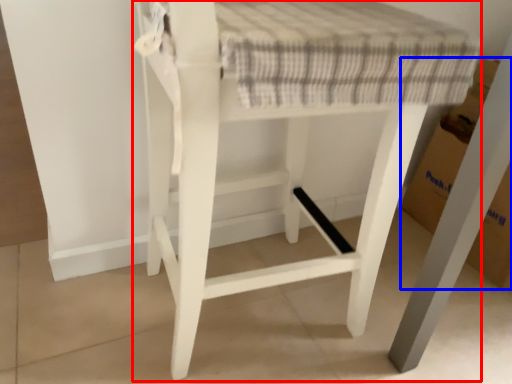
Question: Which object appears closest to the camera in this image, furniture (highlighted by a red box) or cardboard box (highlighted by a blue box)?

Choices:
 (A) furniture
 (B) cardboard box

Answer: (A)